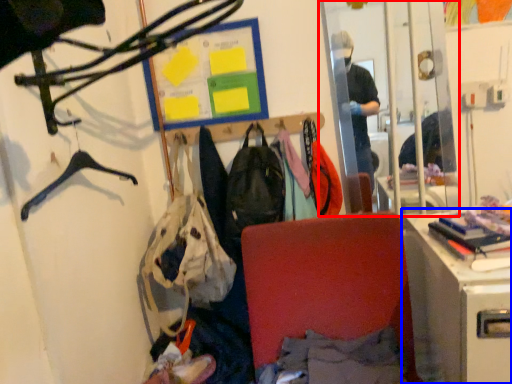
Question: Among these objects, which one is nearest to the camera, mirror (highlighted by a red box) or desk (highlighted by a blue box)?

Choices:
 (A) mirror
 (B) desk

Answer: (B)